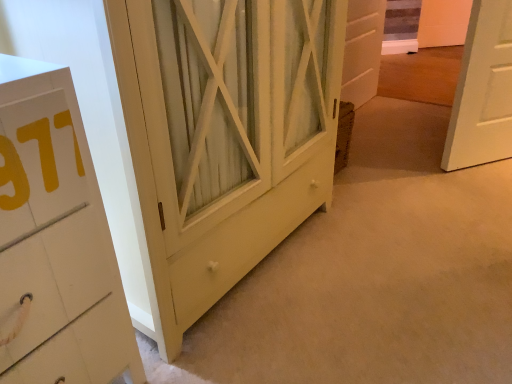
Question: From a real-world perspective, is matte yellow cabinet at center positioned above or below white wood door at center?

Choices:
 (A) below
 (B) above

Answer: (B)

Question: Is matte yellow cabinet at center inside the boundaries of white wood door at center, or outside?

Choices:
 (A) inside
 (B) outside

Answer: (B)

Question: Is matte yellow cabinet at center taller or shorter than white wood door at center?

Choices:
 (A) tall
 (B) short

Answer: (A)

Question: Would you say white wood door at center is inside or outside matte yellow cabinet at center?

Choices:
 (A) outside
 (B) inside

Answer: (A)

Question: Looking at their shapes, would you say white wood door at center is wider or thinner than matte yellow cabinet at center?

Choices:
 (A) thin
 (B) wide

Answer: (A)

Question: From the image's perspective, is white wood door at center above or below matte yellow cabinet at center?

Choices:
 (A) above
 (B) below

Answer: (A)

Question: Is point (370, 61) positioned closer to the camera than point (287, 178)?

Choices:
 (A) farther
 (B) closer

Answer: (A)